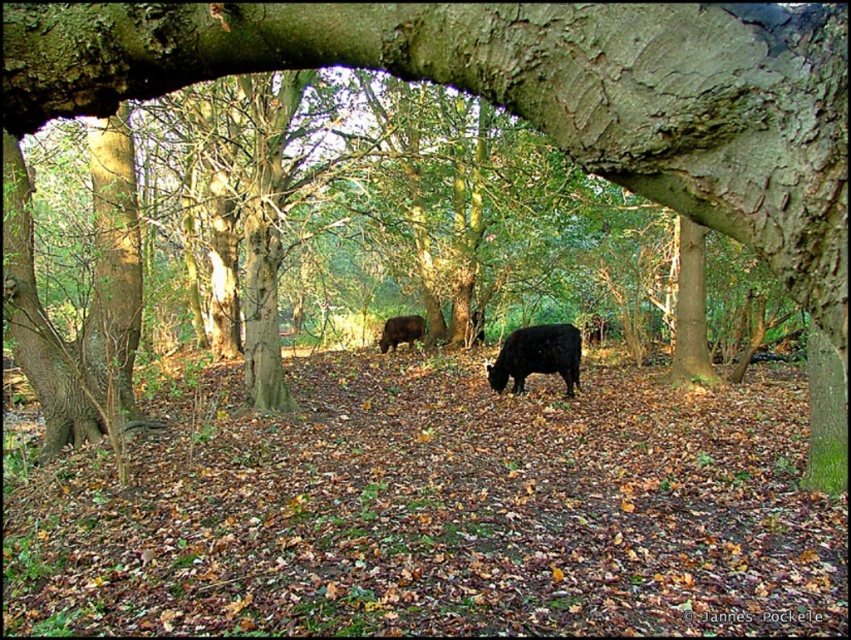
Question: Which point is farther from the camera taking this photo?

Choices:
 (A) (398, 340)
 (B) (580, 339)

Answer: (A)

Question: Which of the following is the closest to the observer?

Choices:
 (A) (380, 348)
 (B) (560, 330)

Answer: (B)

Question: Can you confirm if black glossy cow at center is bigger than shiny brown cow at center?

Choices:
 (A) yes
 (B) no

Answer: (A)

Question: Among these points, which one is nearest to the camera?

Choices:
 (A) (550, 344)
 (B) (384, 336)

Answer: (A)

Question: Can you confirm if black glossy cow at center is positioned above shiny brown cow at center?

Choices:
 (A) no
 (B) yes

Answer: (A)

Question: From the image, what is the correct spatial relationship of black glossy cow at center in relation to shiny brown cow at center?

Choices:
 (A) above
 (B) below

Answer: (B)